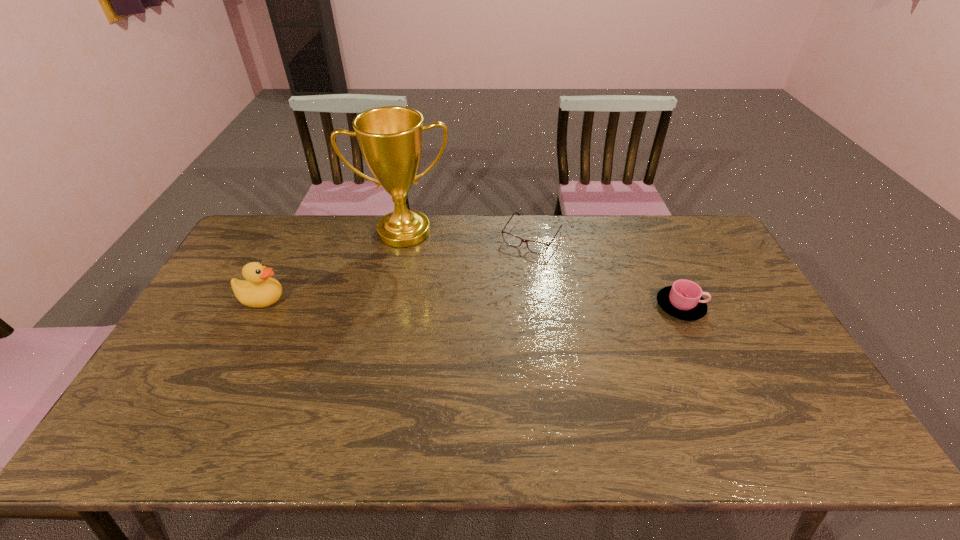
Find the location of a particular element. The image size is (960, 540). vacant space on the desktop that is between the leftmost object and the cup and is positioned by the handles of the third object from right to left is located at coordinates (411, 302).

Find the location of a particular element. free space on the desktop that is between the duck and the third tallest object and is positioned on the lenses of the shortest object is located at coordinates (489, 303).